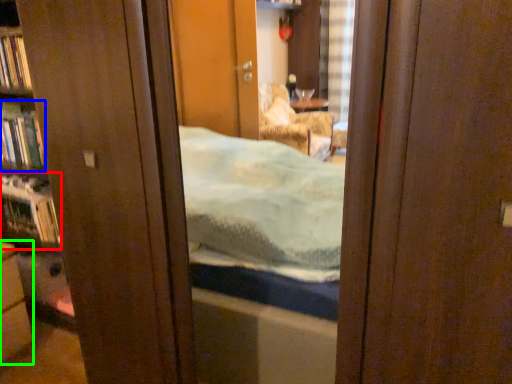
Question: Estimate the real-world distances between objects in this image. Which object is farther from shelf (highlighted by a red box), book (highlighted by a blue box) or cabinetry (highlighted by a green box)?

Choices:
 (A) book
 (B) cabinetry

Answer: (B)